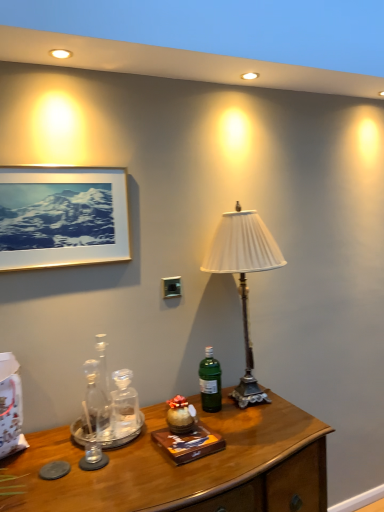
Question: Does gold-framed picture at upper left have a larger size compared to green glass bottle at center?

Choices:
 (A) yes
 (B) no

Answer: (A)

Question: Is gold-framed picture at upper left looking in the opposite direction of green glass bottle at center?

Choices:
 (A) yes
 (B) no

Answer: (B)

Question: Does gold-framed picture at upper left appear on the left side of green glass bottle at center?

Choices:
 (A) no
 (B) yes

Answer: (B)

Question: Can you confirm if gold-framed picture at upper left is positioned to the right of green glass bottle at center?

Choices:
 (A) yes
 (B) no

Answer: (B)

Question: From a real-world perspective, is gold-framed picture at upper left physically above green glass bottle at center?

Choices:
 (A) yes
 (B) no

Answer: (A)

Question: In terms of width, does gold-framed picture at upper left look wider or thinner when compared to green glass bottle at center?

Choices:
 (A) wide
 (B) thin

Answer: (B)

Question: In the image, is gold-framed picture at upper left on the left side or the right side of green glass bottle at center?

Choices:
 (A) left
 (B) right

Answer: (A)

Question: Is gold-framed picture at upper left bigger or smaller than green glass bottle at center?

Choices:
 (A) big
 (B) small

Answer: (A)

Question: From a real-world perspective, is gold-framed picture at upper left physically located above or below green glass bottle at center?

Choices:
 (A) above
 (B) below

Answer: (A)

Question: Is point (319, 436) closer or farther from the camera than point (235, 237)?

Choices:
 (A) farther
 (B) closer

Answer: (B)

Question: Is wooden desk at lower center in front of or behind white pleated fabric lampshade at center in the image?

Choices:
 (A) behind
 (B) front

Answer: (B)

Question: From a real-world perspective, is wooden desk at lower center above or below white pleated fabric lampshade at center?

Choices:
 (A) below
 (B) above

Answer: (A)

Question: From the image's perspective, is wooden desk at lower center positioned above or below white pleated fabric lampshade at center?

Choices:
 (A) below
 (B) above

Answer: (A)

Question: Is point (253, 221) closer or farther from the camera than point (248, 410)?

Choices:
 (A) closer
 (B) farther

Answer: (A)

Question: Considering the positions of white pleated fabric lampshade at center and wooden desk at lower center in the image, is white pleated fabric lampshade at center taller or shorter than wooden desk at lower center?

Choices:
 (A) tall
 (B) short

Answer: (A)